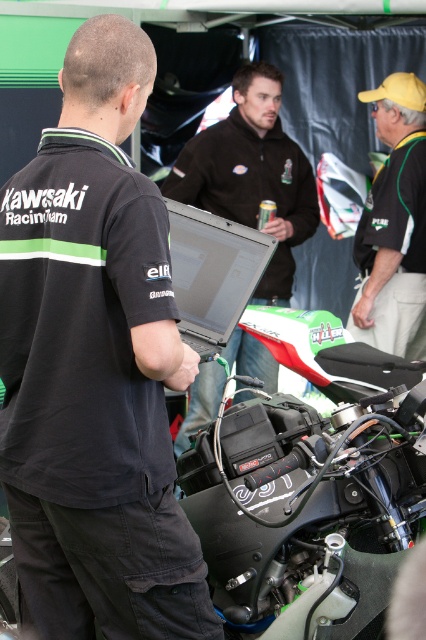
Consider the image. Between black fabric shirt at center and black matte motorcycle at center, which one is positioned higher?

Positioned higher is black fabric shirt at center.

Which is more to the left, black fabric shirt at center or black matte motorcycle at center?

black fabric shirt at center

The width and height of the screenshot is (426, 640). Find the location of `black fabric shirt at center`. black fabric shirt at center is located at coordinates (94, 368).

Is black matte motorcycle at center positioned in front of yellow fabric cap at upper right?

Yes, it is.

Can you confirm if black matte motorcycle at center is positioned above yellow fabric cap at upper right?

Actually, black matte motorcycle at center is below yellow fabric cap at upper right.

I want to click on black matte motorcycle at center, so click(310, 486).

Between black matte motorcycle at center and dark brown leather jacket at center, which one has more height?

dark brown leather jacket at center is taller.

Is point (281, 433) positioned in front of point (253, 227)?

Yes, point (281, 433) is closer to viewer.

Where is `black matte motorcycle at center`? black matte motorcycle at center is located at coordinates (310, 486).